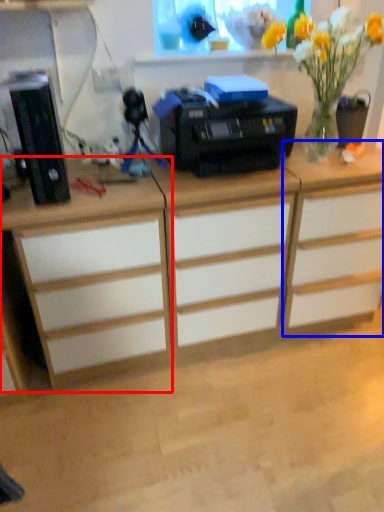
Question: Which object is further to the camera taking this photo, desk (highlighted by a red box) or cabinetry (highlighted by a blue box)?

Choices:
 (A) desk
 (B) cabinetry

Answer: (B)